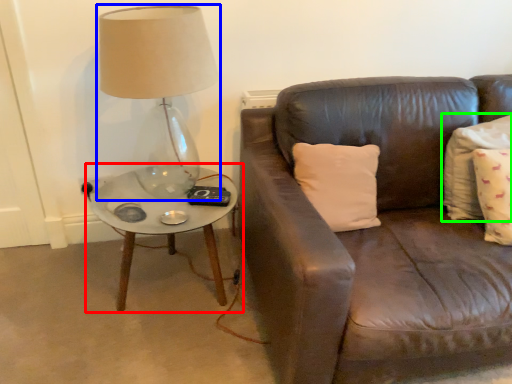
Question: Which object is positioned closest to coffee table (highlighted by a red box)? Select from lamp (highlighted by a blue box) and pillow (highlighted by a green box).

Choices:
 (A) lamp
 (B) pillow

Answer: (A)